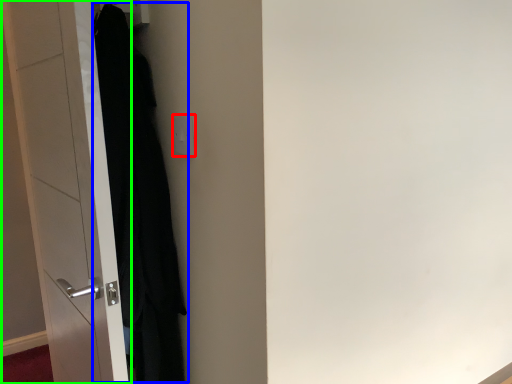
Question: Which is nearer to the electric outlet (highlighted by a red box)? clothing (highlighted by a blue box) or door (highlighted by a green box).

Choices:
 (A) clothing
 (B) door

Answer: (A)